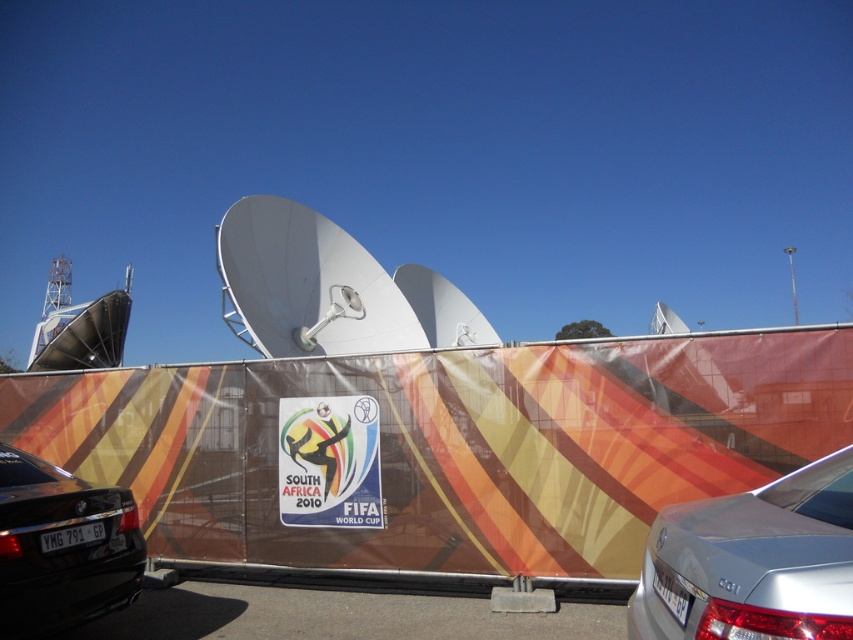
From the picture: Could you measure the distance between white plastic license plate at lower right and black plastic license plate at lower left?

The distance of white plastic license plate at lower right from black plastic license plate at lower left is 3.47 meters.

Is white plastic license plate at lower right above black plastic license plate at lower left?

Yes, white plastic license plate at lower right is above black plastic license plate at lower left.

What do you see at coordinates (672, 592) in the screenshot?
I see `white plastic license plate at lower right` at bounding box center [672, 592].

Where is `white plastic license plate at lower right`? The image size is (853, 640). white plastic license plate at lower right is located at coordinates (672, 592).

Who is positioned more to the left, silver metallic sedan at lower right or white plastic license plate at lower right?

Positioned to the left is white plastic license plate at lower right.

Does silver metallic sedan at lower right lie behind white plastic license plate at lower right?

That is False.

At what (x,y) coordinates should I click in order to perform the action: click on silver metallic sedan at lower right. Please return your answer as a coordinate pair (x, y). Looking at the image, I should click on (752, 563).

Locate an element on the screen. The width and height of the screenshot is (853, 640). silver metallic sedan at lower right is located at coordinates (752, 563).

Can you confirm if shiny black sedan at lower left is thinner than black plastic license plate at lower left?

Incorrect, shiny black sedan at lower left's width is not less than black plastic license plate at lower left's.

Between shiny black sedan at lower left and black plastic license plate at lower left, which one is positioned higher?

black plastic license plate at lower left is above.

Between point (32, 532) and point (99, 524), which one is positioned in front?

Point (32, 532)

Image resolution: width=853 pixels, height=640 pixels. What are the coordinates of `shiny black sedan at lower left` in the screenshot? It's located at (62, 547).